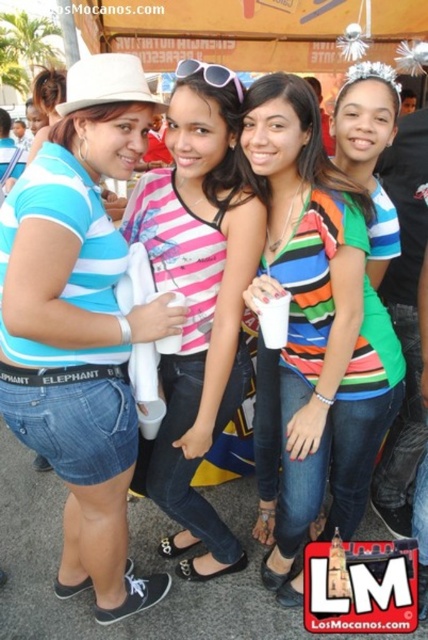
You are a photographer trying to focus on the pink striped shirt at center and the pink plastic sunglasses at center. Which object should you adjust your focus on to capture both in the same frame?

The pink striped shirt at center is further to the viewer than the pink plastic sunglasses at center, so adjusting focus on the pink striped shirt at center would help capture both in the same frame since it is closer to the camera.

In the scene described, there are two women wearing striped tops. The first woman is wearing a striped jersey at center, and the second is wearing a pink striped shirt at center. From the perspective of someone standing in front of them, which striped top is positioned to the right?

The striped jersey at center is to the right of the pink striped shirt at center.

You are a photographer trying to capture a clear shot of the pink striped shirt at center and the pink plastic sunglasses at center. Which object should you focus on first if you want to ensure both are in focus?

The pink striped shirt at center is much taller than the pink plastic sunglasses at center, so you should focus on the pink striped shirt at center first to ensure both are in focus.